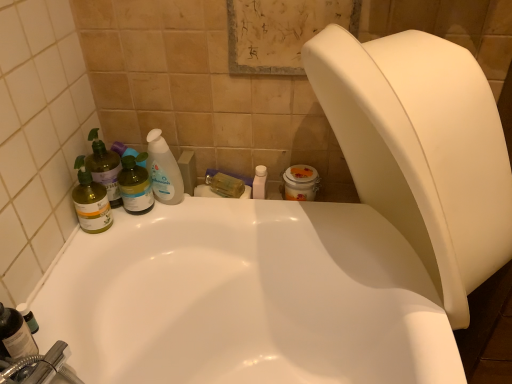
The image size is (512, 384). Identify the location of translucent green spray bottle at left, the 2th cleaning product positioned from the right. (104, 168).

Identify the location of translucent plastic bottle at upper left, marked as the first cleaning product in a right-to-left arrangement. (163, 170).

What do you see at coordinates (422, 149) in the screenshot? The width and height of the screenshot is (512, 384). I see `white plastic bidet at upper right` at bounding box center [422, 149].

At what (x,y) coordinates should I click in order to perform the action: click on translucent green bottle at left, which is counted as the 3th cleaning product, starting from the right. Please return your answer as a coordinate pair (x, y). Looking at the image, I should click on (91, 201).

Identify the location of toiletry that is the 1st one below the translucent plastic bottle at left (from a real-world perspective). This screenshot has width=512, height=384. (28, 317).

Is translucent plastic bottle at left behind translucent plastic bottle at lower left, the 2th toiletry from the back?

Yes.

From the image's perspective, which one is positioned lower, translucent plastic bottle at left or translucent plastic bottle at lower left, the 1th toiletry when ordered from front to back?

translucent plastic bottle at lower left, the 1th toiletry when ordered from front to back, appears lower in the image.

Which object is closer to the camera taking this photo, translucent plastic bottle at lower left, the 2th toiletry from the back, or white glossy bottle at center, the 1th toiletry when ordered from back to front?

Positioned in front is translucent plastic bottle at lower left, the 2th toiletry from the back.

Is point (31, 315) closer to camera compared to point (253, 180)?

That is True.

Is translucent plastic bottle at lower left, which is the first toiletry from bottom to top, touching white glossy bottle at center, the 2th toiletry in the bottom-to-top sequence?

No, translucent plastic bottle at lower left, which is the first toiletry from bottom to top, is not in contact with white glossy bottle at center, the 2th toiletry in the bottom-to-top sequence.

Can you confirm if translucent plastic bottle at lower left, which is counted as the 1th toiletry, starting from the left, is wider than white glossy bottle at center, which appears as the first toiletry when viewed from the right?

In fact, translucent plastic bottle at lower left, which is counted as the 1th toiletry, starting from the left, might be narrower than white glossy bottle at center, which appears as the first toiletry when viewed from the right.

Which is in front, white plastic bidet at upper right or translucent plastic bottle at left?

white plastic bidet at upper right is more forward.

Is point (365, 96) positioned after point (139, 206)?

No, (365, 96) is closer to viewer.

Between white plastic bidet at upper right and translucent plastic bottle at left, which one appears on the right side from the viewer's perspective?

white plastic bidet at upper right.

Who is shorter, white plastic bidet at upper right or translucent plastic bottle at left?

Standing shorter between the two is translucent plastic bottle at left.

What's the angular difference between translucent plastic bottle at upper left, marked as the first cleaning product in a right-to-left arrangement, and white glossy bottle at center, which is the second toiletry from front to back,'s facing directions?

translucent plastic bottle at upper left, marked as the first cleaning product in a right-to-left arrangement, and white glossy bottle at center, which is the second toiletry from front to back, are facing 6.98 degrees away from each other.

At what (x,y) coordinates should I click in order to perform the action: click on cleaning product that is the 2nd one when counting upward from the white glossy bottle at center, the first toiletry positioned from the top (from the image's perspective). Please return your answer as a coordinate pair (x, y). The height and width of the screenshot is (384, 512). Looking at the image, I should click on (163, 170).

Based on the photo, who is taller, translucent plastic bottle at upper left, the third cleaning product positioned from the left, or white glossy bottle at center, which appears as the first toiletry when viewed from the right?

Standing taller between the two is translucent plastic bottle at upper left, the third cleaning product positioned from the left.

Is point (164, 146) closer or farther from the camera than point (265, 175)?

Point (164, 146).

Find the location of a particular element. This screenshot has width=512, height=384. the 1st cleaning product positioned below the white plastic bidet at upper right (from a real-world perspective) is located at coordinates (163, 170).

Is white plastic bidet at upper right facing towards translucent plastic bottle at upper left, marked as the first cleaning product in a right-to-left arrangement?

No, white plastic bidet at upper right is not facing towards translucent plastic bottle at upper left, marked as the first cleaning product in a right-to-left arrangement.

Considering the positions of points (438, 231) and (155, 133), is point (438, 231) farther from camera compared to point (155, 133)?

That is False.

Can you confirm if white plastic bidet at upper right is smaller than translucent plastic bottle at upper left, the third cleaning product positioned from the left?

Incorrect, white plastic bidet at upper right is not smaller in size than translucent plastic bottle at upper left, the third cleaning product positioned from the left.

Is white plastic bidet at upper right turned away from translucent green bottle at left, which is counted as the 3th cleaning product, starting from the right?

No.

How many degrees apart are the facing directions of white plastic bidet at upper right and translucent green bottle at left, which is counted as the 3th cleaning product, starting from the right?

4.63 degrees.

From a real-world perspective, is white plastic bidet at upper right above or below translucent green bottle at left, which ranks as the 1th cleaning product in left-to-right order?

In terms of real-world spatial position, white plastic bidet at upper right is above translucent green bottle at left, which ranks as the 1th cleaning product in left-to-right order.

Looking at this image, considering the positions of objects white glossy bottle at center, which appears as the first toiletry when viewed from the right, and translucent green bottle at left, which is counted as the 3th cleaning product, starting from the right, in the image provided, who is in front, white glossy bottle at center, which appears as the first toiletry when viewed from the right, or translucent green bottle at left, which is counted as the 3th cleaning product, starting from the right,?

translucent green bottle at left, which is counted as the 3th cleaning product, starting from the right, is in front.

From a real-world perspective, which object stands above the other?

In real-world perspective, translucent green bottle at left, which ranks as the 1th cleaning product in left-to-right order, is above.

Is white glossy bottle at center, the 2th toiletry in the bottom-to-top sequence, next to translucent green bottle at left, which ranks as the 1th cleaning product in left-to-right order?

There is a gap between white glossy bottle at center, the 2th toiletry in the bottom-to-top sequence, and translucent green bottle at left, which ranks as the 1th cleaning product in left-to-right order.

The width and height of the screenshot is (512, 384). I want to click on toiletry that is the 2nd one when counting downward from the translucent plastic bottle at left (from the image's perspective), so click(28, 317).

Where is `toiletry lying in front of the white glossy bottle at center, which is the second toiletry from front to back`? This screenshot has height=384, width=512. toiletry lying in front of the white glossy bottle at center, which is the second toiletry from front to back is located at coordinates (28, 317).

Estimate the real-world distances between objects in this image. Which object is closer to translucent green bottle at left, which ranks as the 1th cleaning product in left-to-right order, white glossy bottle at center, the 1th toiletry when ordered from back to front, or translucent plastic bottle at upper left, the third cleaning product positioned from the left?

translucent plastic bottle at upper left, the third cleaning product positioned from the left, lies closer to translucent green bottle at left, which ranks as the 1th cleaning product in left-to-right order, than the other object.

Which object lies further to the anchor point white plastic bidet at upper right, translucent plastic bottle at lower left, the 1th toiletry when ordered from front to back, or translucent plastic bottle at left?

The object further to white plastic bidet at upper right is translucent plastic bottle at lower left, the 1th toiletry when ordered from front to back.

Based on their spatial positions, is translucent plastic bottle at left or translucent plastic bottle at lower left, which is counted as the 1th toiletry, starting from the left, closer to translucent green spray bottle at left, placed as the 2th cleaning product when sorted from left to right?

Among the two, translucent plastic bottle at left is located nearer to translucent green spray bottle at left, placed as the 2th cleaning product when sorted from left to right.

Considering their positions, is white glossy bottle at center, the 2th toiletry in the bottom-to-top sequence, positioned further to translucent green bottle at left, which ranks as the 1th cleaning product in left-to-right order, than translucent plastic bottle at lower left, the 2th toiletry from the back?

Based on the image, white glossy bottle at center, the 2th toiletry in the bottom-to-top sequence, appears to be further to translucent green bottle at left, which ranks as the 1th cleaning product in left-to-right order.

Looking at the image, which one is located closer to translucent green spray bottle at left, placed as the 2th cleaning product when sorted from left to right, translucent plastic bottle at lower left, the 1th toiletry when ordered from front to back, or white glossy bottle at center, the first toiletry positioned from the top?

translucent plastic bottle at lower left, the 1th toiletry when ordered from front to back, lies closer to translucent green spray bottle at left, placed as the 2th cleaning product when sorted from left to right, than the other object.

Estimate the real-world distances between objects in this image. Which object is closer to translucent plastic bottle at upper left, the third cleaning product positioned from the left, white plastic bidet at upper right or translucent plastic bottle at lower left, the 1th toiletry when ordered from front to back?

translucent plastic bottle at lower left, the 1th toiletry when ordered from front to back, lies closer to translucent plastic bottle at upper left, the third cleaning product positioned from the left, than the other object.

When comparing their distances from translucent plastic bottle at lower left, which is the second toiletry in top-to-bottom order, does translucent green spray bottle at left, placed as the 2th cleaning product when sorted from left to right, or white glossy bottle at center, the 1th toiletry when ordered from back to front, seem further?

The object further to translucent plastic bottle at lower left, which is the second toiletry in top-to-bottom order, is white glossy bottle at center, the 1th toiletry when ordered from back to front.

Estimate the real-world distances between objects in this image. Which object is further from translucent plastic bottle at left, translucent green bottle at left, which is counted as the 3th cleaning product, starting from the right, or translucent plastic bottle at lower left, which is counted as the 1th toiletry, starting from the left?

translucent plastic bottle at lower left, which is counted as the 1th toiletry, starting from the left, is positioned further to the anchor translucent plastic bottle at left.

You are a GUI agent. You are given a task and a screenshot of the screen. Output one action in this format:
    pyautogui.click(x=<x>, y=<y>)
    Task: Click on the bottle between translucent plastic bottle at lower left, the 2th toiletry when ordered from right to left, and white plastic bidet at upper right from left to right
    This screenshot has width=512, height=384.
    Given the screenshot: What is the action you would take?
    pyautogui.click(x=135, y=185)

Locate an element on the screen. cleaning product between translucent green bottle at left, which is counted as the 3th cleaning product, starting from the right, and translucent plastic bottle at left from left to right is located at coordinates (104, 168).

This screenshot has height=384, width=512. What are the coordinates of `cleaning product situated between translucent plastic bottle at left and white glossy bottle at center, which appears as the first toiletry when viewed from the right, from left to right` in the screenshot? It's located at (163, 170).

Identify the location of bottle between translucent green spray bottle at left, the 2th cleaning product positioned from the right, and white plastic bidet at upper right, in the horizontal direction. (135, 185).